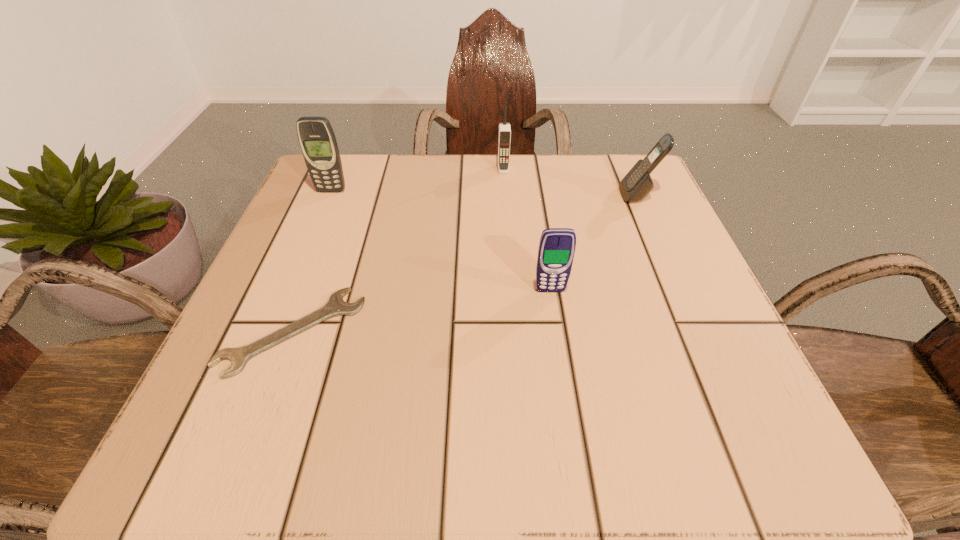
Locate an element on the screen. the farthest cellular telephone is located at coordinates (504, 138).

Where is `the farthest object`? the farthest object is located at coordinates (504, 138).

Image resolution: width=960 pixels, height=540 pixels. In order to click on the leftmost cellular telephone in this screenshot , I will do `click(317, 140)`.

This screenshot has height=540, width=960. Find the location of `the rightmost cellular telephone`. the rightmost cellular telephone is located at coordinates (637, 184).

Identify the location of the second object from right to left. This screenshot has height=540, width=960. (x=556, y=251).

Where is `the second cellular telephone from right to left`? the second cellular telephone from right to left is located at coordinates (556, 251).

Identify the location of the shortest object. (335, 306).

Where is `free space located 0.190m on the front-facing side of the farthest cellular telephone`? The image size is (960, 540). free space located 0.190m on the front-facing side of the farthest cellular telephone is located at coordinates (507, 228).

This screenshot has height=540, width=960. I want to click on vacant point located on the screen of the leftmost cellular telephone, so click(x=301, y=261).

Where is `vacant space located on the front-facing side of the rightmost cellular telephone`? vacant space located on the front-facing side of the rightmost cellular telephone is located at coordinates (452, 195).